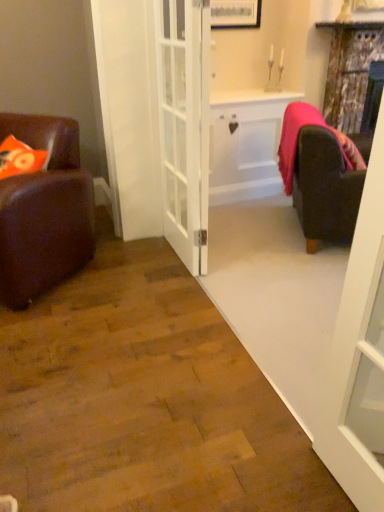
Question: Does white matte cabinet at center have a lesser width compared to velvet dark brown armchair at right?

Choices:
 (A) yes
 (B) no

Answer: (A)

Question: Does white matte cabinet at center have a smaller size compared to velvet dark brown armchair at right?

Choices:
 (A) no
 (B) yes

Answer: (B)

Question: Would you consider white matte cabinet at center to be distant from velvet dark brown armchair at right?

Choices:
 (A) yes
 (B) no

Answer: (B)

Question: Could you tell me if white matte cabinet at center is turned towards velvet dark brown armchair at right?

Choices:
 (A) no
 (B) yes

Answer: (B)

Question: Does white matte cabinet at center appear on the right side of velvet dark brown armchair at right?

Choices:
 (A) yes
 (B) no

Answer: (B)

Question: From a real-world perspective, is white matte cabinet at center on velvet dark brown armchair at right?

Choices:
 (A) yes
 (B) no

Answer: (B)

Question: Is white matte cabinet at center to the left of white glass door at center, which is counted as the first door, starting from the left, from the viewer's perspective?

Choices:
 (A) yes
 (B) no

Answer: (B)

Question: Does white matte cabinet at center appear on the right side of white glass door at center, which is the second door from right to left?

Choices:
 (A) yes
 (B) no

Answer: (A)

Question: From a real-world perspective, is white matte cabinet at center positioned over white glass door at center, the 1th door positioned from the back, based on gravity?

Choices:
 (A) yes
 (B) no

Answer: (B)

Question: Does white matte cabinet at center have a greater height compared to white glass door at center, the 1th door positioned from the back?

Choices:
 (A) no
 (B) yes

Answer: (A)

Question: Does white matte cabinet at center have a greater width compared to white glass door at center, which is counted as the first door, starting from the left?

Choices:
 (A) yes
 (B) no

Answer: (A)

Question: Does white matte cabinet at center turn towards white glass door at center, the second door in the front-to-back sequence?

Choices:
 (A) yes
 (B) no

Answer: (B)

Question: Is white glass door at right, the second door when ordered from back to front, a part of distressed wood curtain at upper right?

Choices:
 (A) no
 (B) yes

Answer: (A)